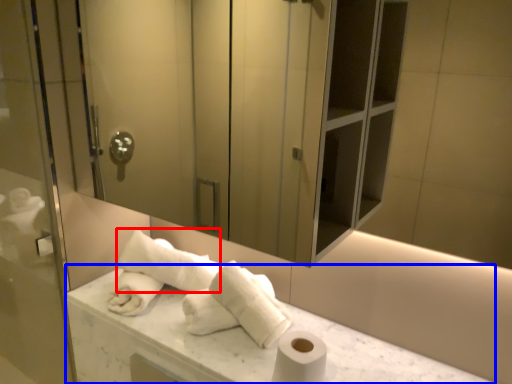
Question: Which of the following is the farthest to the observer, bath towel (highlighted by a red box) or counter top (highlighted by a blue box)?

Choices:
 (A) bath towel
 (B) counter top

Answer: (A)